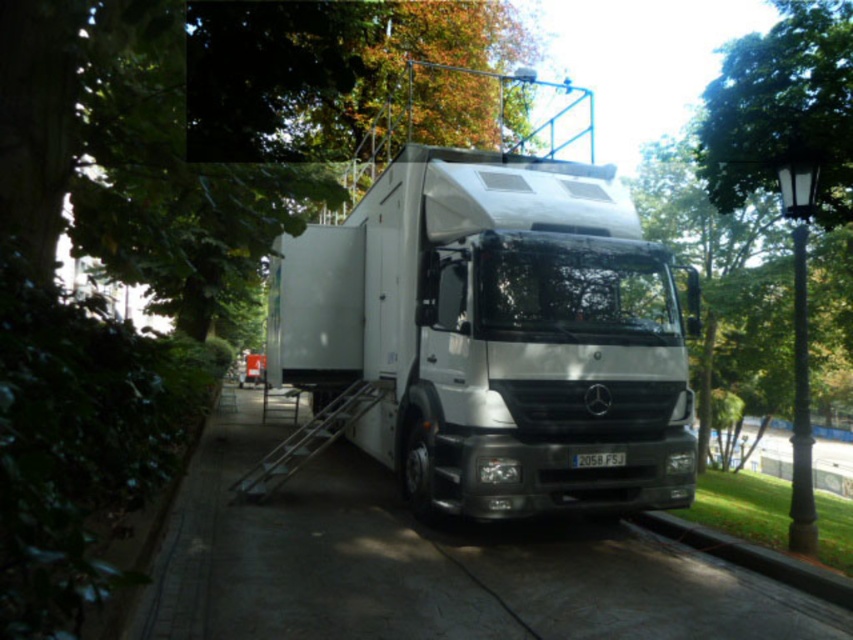
Does white metallic truck at center appear on the right side of paved concrete sidewalk at center?

Correct, you'll find white metallic truck at center to the right of paved concrete sidewalk at center.

Between white metallic truck at center and paved concrete sidewalk at center, which one has less height?

With less height is white metallic truck at center.

Is point (643, 394) positioned in front of point (381, 518)?

That is True.

Where is `white metallic truck at center`? This screenshot has height=640, width=853. white metallic truck at center is located at coordinates (494, 336).